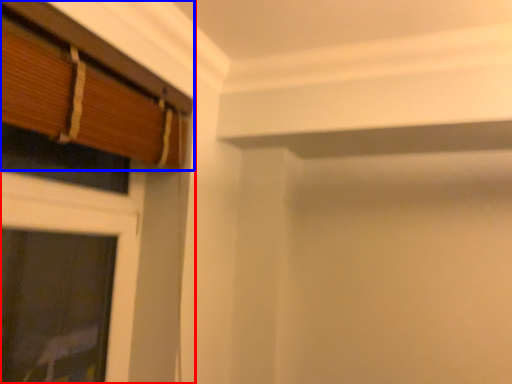
Question: Which of the following is the closest to the observer, window (highlighted by a red box) or window (highlighted by a blue box)?

Choices:
 (A) window
 (B) window

Answer: (B)